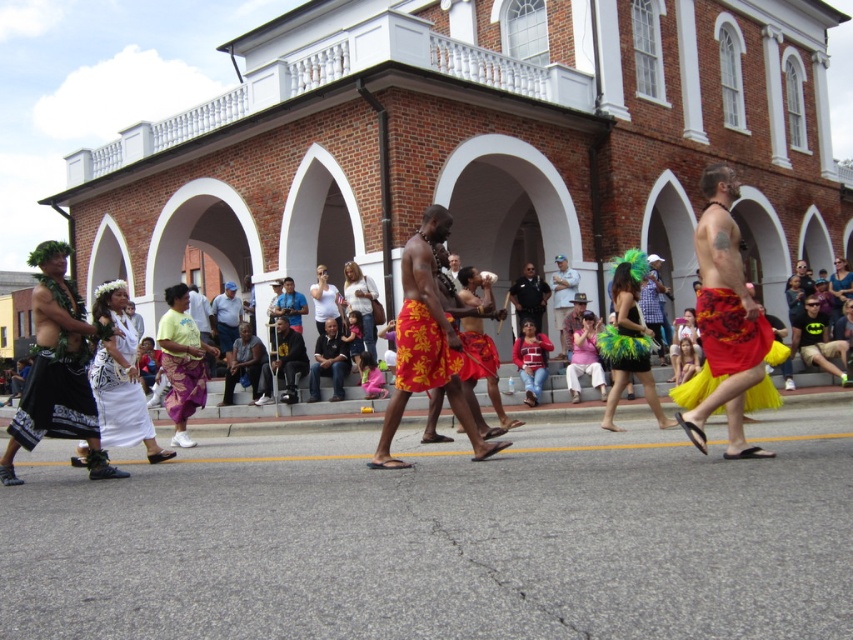
What are the coordinates of `light blue fabric shirt at center` in the screenshot? It's located at (225, 317).

You are a GUI agent. You are given a task and a screenshot of the screen. Output one action in this format:
    pyautogui.click(x=<x>, y=<y>)
    Task: Click on the light blue fabric shirt at center
    
    Given the screenshot: What is the action you would take?
    pyautogui.click(x=225, y=317)

Which is more to the left, red fabric skirt at center or red floral skirt at center?

red fabric skirt at center is more to the left.

At what (x,y) coordinates should I click in order to perform the action: click on red fabric skirt at center. Please return your answer as a coordinate pair (x, y). This screenshot has width=853, height=640. Looking at the image, I should click on (724, 317).

Is red fabric skirt at center below matte black uniform at center?

Correct, red fabric skirt at center is located below matte black uniform at center.

Does point (747, 378) lie behind point (527, 280)?

No.

Where is `red fabric skirt at center`? The width and height of the screenshot is (853, 640). red fabric skirt at center is located at coordinates (724, 317).